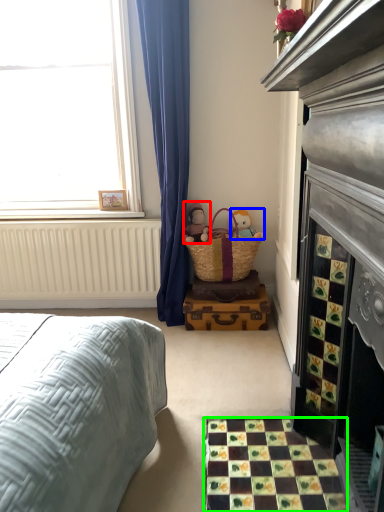
Question: Which is farther away from doll (highlighted by a red box)? toy (highlighted by a blue box) or tile (highlighted by a green box)?

Choices:
 (A) toy
 (B) tile

Answer: (B)